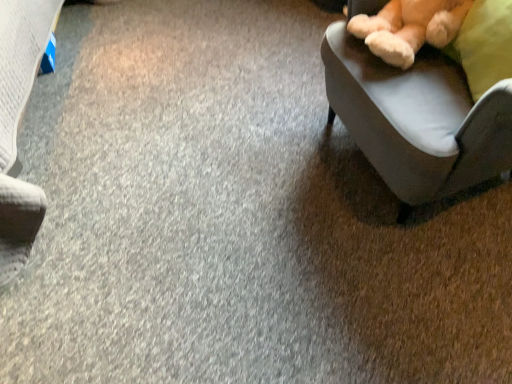
Question: In the image, is soft plush teddy bear at upper right positioned in front of or behind velvet-like beige chair at right?

Choices:
 (A) behind
 (B) front

Answer: (A)

Question: Is soft plush teddy bear at upper right to the left or to the right of velvet-like beige chair at right in the image?

Choices:
 (A) left
 (B) right

Answer: (A)

Question: From a real-world perspective, is soft plush teddy bear at upper right above or below velvet-like beige chair at right?

Choices:
 (A) below
 (B) above

Answer: (B)

Question: In terms of height, does velvet-like beige chair at right look taller or shorter compared to soft plush teddy bear at upper right?

Choices:
 (A) short
 (B) tall

Answer: (B)

Question: In the image, is velvet-like beige chair at right positioned in front of or behind soft plush teddy bear at upper right?

Choices:
 (A) front
 (B) behind

Answer: (A)

Question: In terms of size, does velvet-like beige chair at right appear bigger or smaller than soft plush teddy bear at upper right?

Choices:
 (A) big
 (B) small

Answer: (A)

Question: In terms of width, does velvet-like beige chair at right look wider or thinner when compared to soft plush teddy bear at upper right?

Choices:
 (A) thin
 (B) wide

Answer: (B)